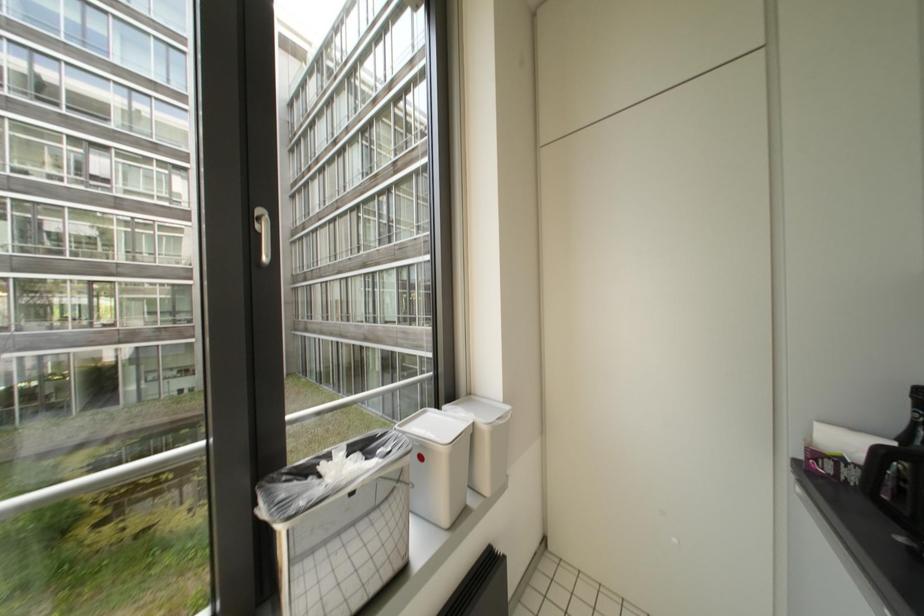
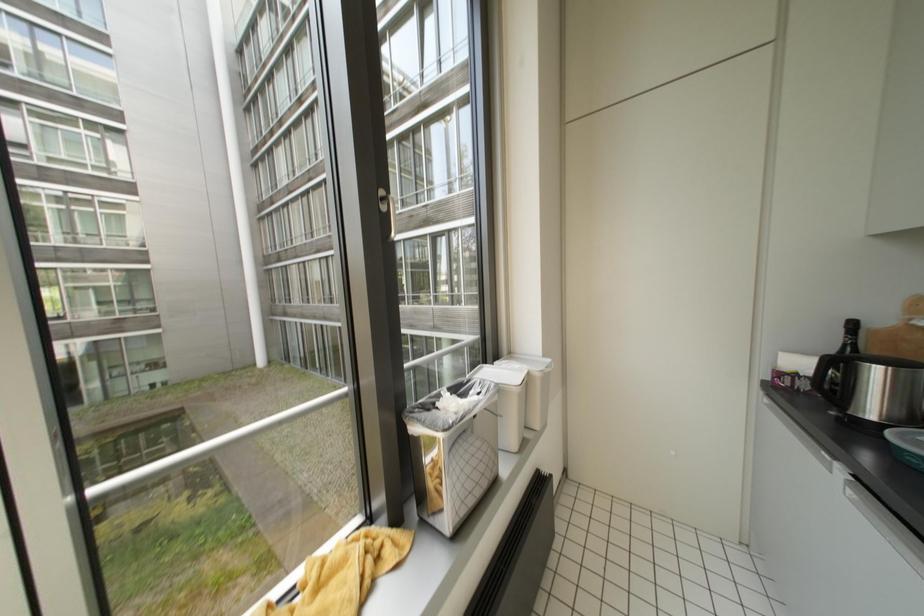
Question: The images are taken continuously from a first-person perspective. In which direction is your viewpoint rotating?

Choices:
 (A) Left
 (B) Right
 (C) Up
 (D) Down

Answer: (D)